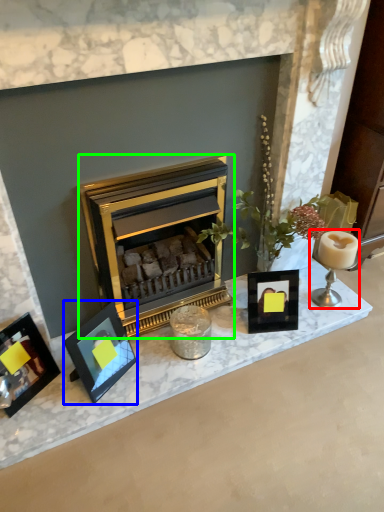
Question: Estimate the real-world distances between objects in this image. Which object is farther from candle holder (highlighted by a red box), picture frame (highlighted by a blue box) or wood burning stove (highlighted by a green box)?

Choices:
 (A) picture frame
 (B) wood burning stove

Answer: (A)